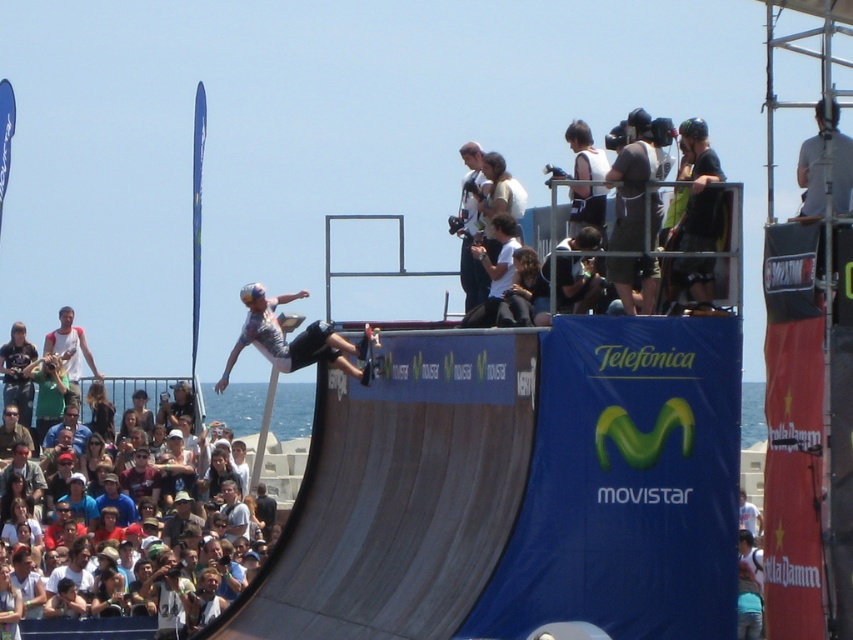
Looking at this image, you are a photographer standing at the event venue. You want to capture a clear photo of the matte gray helmet at center. Given that your camera can focus up to 100 meters, will you be able to capture it clearly?

The matte gray helmet at center is 100.93 meters away from the viewer. Since the camera can only focus up to 100 meters, it won not be able to capture the matte gray helmet at center clearly.

You are a photographer at the skateboarding event. You want to capture a photo of the matte gray helmet at center and the black matte skateboard at center. Which object should you focus on first if you want to prioritize the one that is closer to the camera?

The matte gray helmet at center is much taller than the black matte skateboard at center, so it is closer to the camera. You should focus on the matte gray helmet at center first.

You are a photographer at the skateboarding event. You want to capture the skateboarder midair while ensuring the Telefonica and Movistar logos on the ramp are visible in the background. Where should you position your camera relative to the point labeled as point (x=294, y=339)?

The point (x=294, y=339) corresponds to the matte gray helmet at center. To capture the skateboarder midair with the logos visible, position the camera so that it faces the ramp where the skateboarder is performing the trick, ensuring the helmet at center is in frame while the logos on the ramp remain visible in the background.